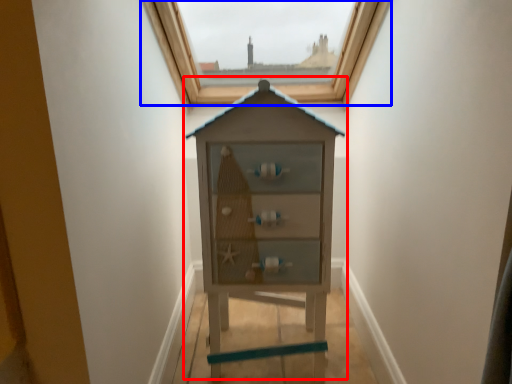
Question: Which point is closer to the camera, dresser (highlighted by a red box) or window (highlighted by a blue box)?

Choices:
 (A) dresser
 (B) window

Answer: (A)